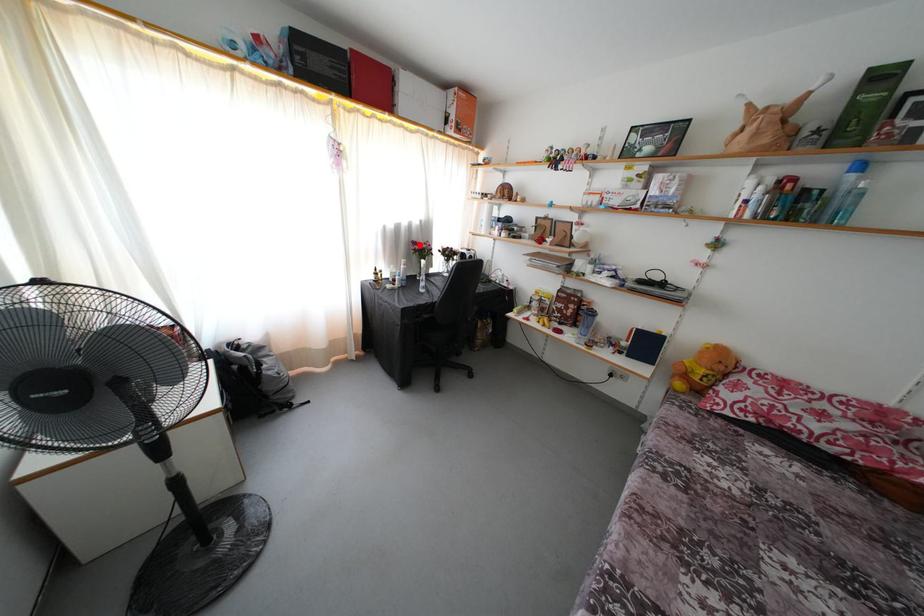
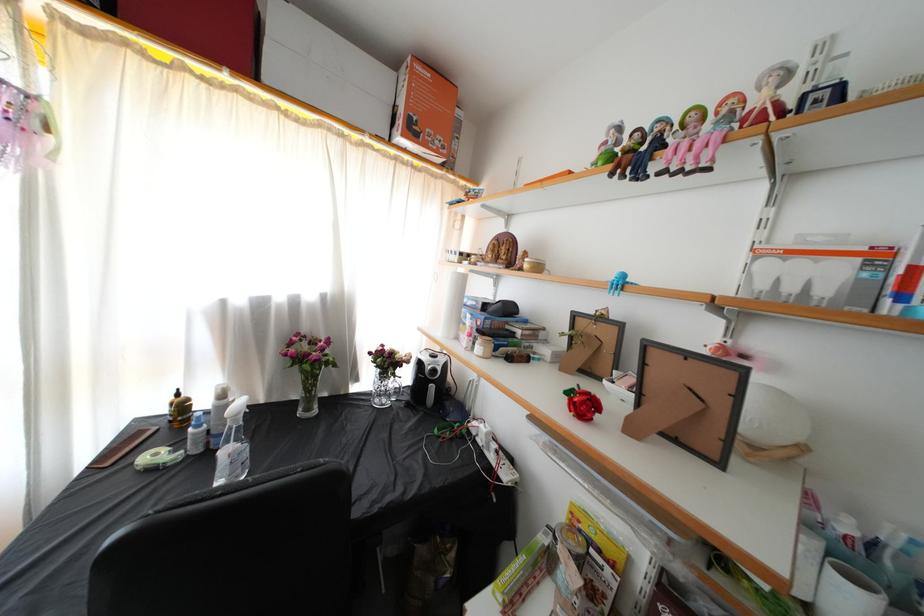
Locate, in the second image, the point that corresponds to the highlighted location in the first image.

(310, 334)